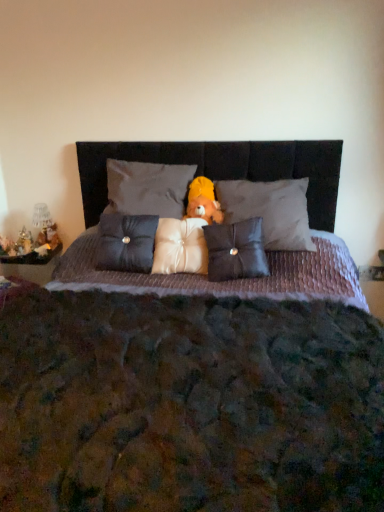
The width and height of the screenshot is (384, 512). What do you see at coordinates (189, 404) in the screenshot?
I see `textured purple quilt at center` at bounding box center [189, 404].

You are a GUI agent. You are given a task and a screenshot of the screen. Output one action in this format:
    pyautogui.click(x=<x>, y=<y>)
    Task: Click on the matte black pillow at center, marked as the 4th pillow in a left-to-right arrangement
    
    Given the screenshot: What is the action you would take?
    pyautogui.click(x=236, y=250)

What do you see at coordinates (50, 234) in the screenshot? I see `metallic gold figurine at left, the first figurine from the right` at bounding box center [50, 234].

Locate an element on the screen. matte gray pillow at center, marked as the 1th pillow in a right-to-left arrangement is located at coordinates (270, 210).

Locate an element on the screen. This screenshot has width=384, height=512. matte gray pillow at center, the second pillow in the left-to-right sequence is located at coordinates (147, 188).

Is matte gray pillow at center, the second pillow in the left-to-right sequence, not close to satin dark blue pillow at center, the first pillow in the left-to-right sequence?

Actually, matte gray pillow at center, the second pillow in the left-to-right sequence, and satin dark blue pillow at center, the first pillow in the left-to-right sequence, are a little close together.

Is matte gray pillow at center, which is counted as the fourth pillow, starting from the right, aimed at satin dark blue pillow at center, marked as the fifth pillow in a right-to-left arrangement?

No, matte gray pillow at center, which is counted as the fourth pillow, starting from the right, is not turned towards satin dark blue pillow at center, marked as the fifth pillow in a right-to-left arrangement.

How many degrees apart are the facing directions of matte gray pillow at center, which is counted as the fourth pillow, starting from the right, and satin dark blue pillow at center, marked as the fifth pillow in a right-to-left arrangement?

Answer: The angular difference between matte gray pillow at center, which is counted as the fourth pillow, starting from the right, and satin dark blue pillow at center, marked as the fifth pillow in a right-to-left arrangement, is 2.7 degrees.

From the image's perspective, is matte black pillow at center, marked as the 4th pillow in a left-to-right arrangement, on top of textured purple quilt at center?

Indeed, from the image's perspective, matte black pillow at center, marked as the 4th pillow in a left-to-right arrangement, is shown above textured purple quilt at center.

Can you tell me how much matte black pillow at center, which is counted as the 2th pillow, starting from the right, and textured purple quilt at center differ in facing direction?

They differ by 7.01 degrees in their facing directions.

Which object is wider, matte black pillow at center, which is counted as the 2th pillow, starting from the right, or textured purple quilt at center?

With larger width is textured purple quilt at center.

Is matte black pillow at center, marked as the 4th pillow in a left-to-right arrangement, to the right of textured purple quilt at center from the viewer's perspective?

Indeed, matte black pillow at center, marked as the 4th pillow in a left-to-right arrangement, is positioned on the right side of textured purple quilt at center.

From the image's perspective, which pillow is the 2nd one above the matte black pillow at center, marked as the 4th pillow in a left-to-right arrangement? Please provide its 2D coordinates.

[(126, 242)]

Between matte black pillow at center, marked as the 4th pillow in a left-to-right arrangement, and satin dark blue pillow at center, marked as the fifth pillow in a right-to-left arrangement, which one has larger width?

Wider between the two is satin dark blue pillow at center, marked as the fifth pillow in a right-to-left arrangement.

Is matte black pillow at center, marked as the 4th pillow in a left-to-right arrangement, surrounding satin dark blue pillow at center, the first pillow in the left-to-right sequence?

No.

Does matte black pillow at center, marked as the 4th pillow in a left-to-right arrangement, touch satin dark blue pillow at center, marked as the fifth pillow in a right-to-left arrangement?

No, matte black pillow at center, marked as the 4th pillow in a left-to-right arrangement, is not touching satin dark blue pillow at center, marked as the fifth pillow in a right-to-left arrangement.

Does point (186, 230) come closer to viewer compared to point (252, 445)?

No, it is behind (252, 445).

How far apart are satin white pillow at center, the third pillow from the right, and textured purple quilt at center?

satin white pillow at center, the third pillow from the right, is 59.18 centimeters away from textured purple quilt at center.

From a real-world perspective, who is located higher, satin white pillow at center, the third pillow from the right, or textured purple quilt at center?

satin white pillow at center, the third pillow from the right, is physically above.

Would you say satin white pillow at center, the third pillow from the right, is to the left or to the right of textured purple quilt at center in the picture?

From the image, it's evident that satin white pillow at center, the third pillow from the right, is to the left of textured purple quilt at center.

Considering the positions of objects yellow plush bear at center and matte gray pillow at center, acting as the 5th pillow starting from the left, in the image provided, who is more to the right, yellow plush bear at center or matte gray pillow at center, acting as the 5th pillow starting from the left,?

matte gray pillow at center, acting as the 5th pillow starting from the left, is more to the right.

Is yellow plush bear at center wider or thinner than matte gray pillow at center, acting as the 5th pillow starting from the left?

yellow plush bear at center is thinner than matte gray pillow at center, acting as the 5th pillow starting from the left.

How far apart are yellow plush bear at center and matte gray pillow at center, marked as the 1th pillow in a right-to-left arrangement?

yellow plush bear at center is 8.05 inches away from matte gray pillow at center, marked as the 1th pillow in a right-to-left arrangement.

Is yellow plush bear at center oriented away from matte gray pillow at center, marked as the 1th pillow in a right-to-left arrangement?

Yes, matte gray pillow at center, marked as the 1th pillow in a right-to-left arrangement, is at the back of yellow plush bear at center.

Is matte gray pillow at center, marked as the 1th pillow in a right-to-left arrangement, not inside metallic gold figurine at left, the first figurine from the right?

Yes, matte gray pillow at center, marked as the 1th pillow in a right-to-left arrangement, is outside of metallic gold figurine at left, the first figurine from the right.

From a real-world perspective, which object stands above the other?

matte gray pillow at center, marked as the 1th pillow in a right-to-left arrangement, is physically above.

Looking at this image, is matte gray pillow at center, marked as the 1th pillow in a right-to-left arrangement, in contact with metallic gold figurine at left, the first figurine from the right?

No, matte gray pillow at center, marked as the 1th pillow in a right-to-left arrangement, is not making contact with metallic gold figurine at left, the first figurine from the right.

Is matte gray pillow at center, acting as the 5th pillow starting from the left, positioned with its back to metallic gold figurine at left, which ranks as the second figurine in left-to-right order?

No.

From a real-world perspective, relative to metallic silver figurine at left, which appears as the 1th figurine when viewed from the left, is textured purple quilt at center vertically above or below?

textured purple quilt at center is situated lower than metallic silver figurine at left, which appears as the 1th figurine when viewed from the left, in the real world.

Considering the relative positions of textured purple quilt at center and metallic silver figurine at left, the second figurine when ordered from right to left, in the image provided, is textured purple quilt at center to the left of metallic silver figurine at left, the second figurine when ordered from right to left, from the viewer's perspective?

In fact, textured purple quilt at center is to the right of metallic silver figurine at left, the second figurine when ordered from right to left.

Is textured purple quilt at center facing away from metallic silver figurine at left, which appears as the 1th figurine when viewed from the left?

textured purple quilt at center does not have its back to metallic silver figurine at left, which appears as the 1th figurine when viewed from the left.

Starting from the satin dark blue pillow at center, the first pillow in the left-to-right sequence, which pillow is the 2nd one behind? Please provide its 2D coordinates.

[(147, 188)]

You are a GUI agent. You are given a task and a screenshot of the screen. Output one action in this format:
    pyautogui.click(x=<x>, y=<y>)
    Task: Click on the bed located underneath the matte black pillow at center, marked as the 4th pillow in a left-to-right arrangement (from a real-world perspective)
    The height and width of the screenshot is (512, 384).
    Given the screenshot: What is the action you would take?
    pyautogui.click(x=189, y=404)

Based on their spatial positions, is metallic gold figurine at left, the first figurine from the right, or matte gray pillow at center, which is counted as the fourth pillow, starting from the right, closer to satin white pillow at center, the third pillow from the right?

matte gray pillow at center, which is counted as the fourth pillow, starting from the right, is positioned closer to the anchor satin white pillow at center, the third pillow from the right.

From the image, which object appears to be nearer to matte gray pillow at center, which is counted as the fourth pillow, starting from the right, metallic silver figurine at left, the second figurine when ordered from right to left, or satin white pillow at center, arranged as the 3th pillow when viewed from the left?

Based on the image, satin white pillow at center, arranged as the 3th pillow when viewed from the left, appears to be nearer to matte gray pillow at center, which is counted as the fourth pillow, starting from the right.

When comparing their distances from satin dark blue pillow at center, the first pillow in the left-to-right sequence, does matte gray pillow at center, acting as the 5th pillow starting from the left, or matte gray pillow at center, the second pillow in the left-to-right sequence, seem closer?

Based on the image, matte gray pillow at center, the second pillow in the left-to-right sequence, appears to be nearer to satin dark blue pillow at center, the first pillow in the left-to-right sequence.

Estimate the real-world distances between objects in this image. Which object is further from satin dark blue pillow at center, the first pillow in the left-to-right sequence, metallic gold figurine at left, which ranks as the second figurine in left-to-right order, or metallic silver figurine at left, which appears as the 1th figurine when viewed from the left?

metallic silver figurine at left, which appears as the 1th figurine when viewed from the left, is positioned further to the anchor satin dark blue pillow at center, the first pillow in the left-to-right sequence.

Based on their spatial positions, is yellow plush bear at center or satin dark blue pillow at center, the first pillow in the left-to-right sequence, closer to matte black pillow at center, which is counted as the 2th pillow, starting from the right?

Based on the image, yellow plush bear at center appears to be nearer to matte black pillow at center, which is counted as the 2th pillow, starting from the right.

From the image, which object appears to be nearer to metallic gold figurine at left, which ranks as the second figurine in left-to-right order, matte gray pillow at center, which is counted as the fourth pillow, starting from the right, or satin dark blue pillow at center, the first pillow in the left-to-right sequence?

satin dark blue pillow at center, the first pillow in the left-to-right sequence, lies closer to metallic gold figurine at left, which ranks as the second figurine in left-to-right order, than the other object.

When comparing their distances from yellow plush bear at center, does matte gray pillow at center, which is counted as the fourth pillow, starting from the right, or matte gray pillow at center, acting as the 5th pillow starting from the left, seem further?

matte gray pillow at center, acting as the 5th pillow starting from the left, is positioned further to the anchor yellow plush bear at center.

Looking at the image, which one is located further to yellow plush bear at center, satin dark blue pillow at center, the first pillow in the left-to-right sequence, or metallic gold figurine at left, which ranks as the second figurine in left-to-right order?

Based on the image, metallic gold figurine at left, which ranks as the second figurine in left-to-right order, appears to be further to yellow plush bear at center.

Where is `doll between satin dark blue pillow at center, the first pillow in the left-to-right sequence, and matte gray pillow at center, marked as the 1th pillow in a right-to-left arrangement`? doll between satin dark blue pillow at center, the first pillow in the left-to-right sequence, and matte gray pillow at center, marked as the 1th pillow in a right-to-left arrangement is located at coordinates (203, 201).

The width and height of the screenshot is (384, 512). I want to click on doll that lies between matte gray pillow at center, which is counted as the fourth pillow, starting from the right, and satin white pillow at center, the third pillow from the right, from top to bottom, so click(203, 201).

Where is `doll between textured purple quilt at center and metallic silver figurine at left, the second figurine when ordered from right to left, along the z-axis`? doll between textured purple quilt at center and metallic silver figurine at left, the second figurine when ordered from right to left, along the z-axis is located at coordinates (203, 201).

This screenshot has width=384, height=512. In order to click on figurine between metallic silver figurine at left, the second figurine when ordered from right to left, and yellow plush bear at center in this screenshot , I will do `click(50, 234)`.